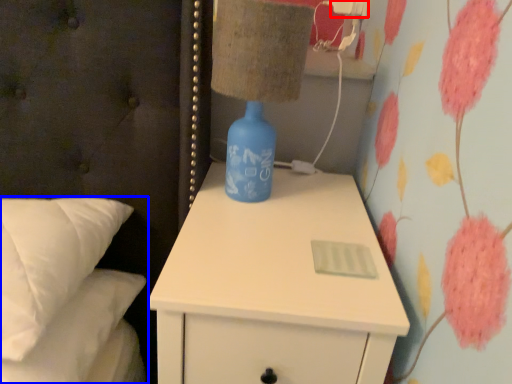
Question: Which object is further to the camera taking this photo, electric outlet (highlighted by a red box) or bed (highlighted by a blue box)?

Choices:
 (A) electric outlet
 (B) bed

Answer: (A)